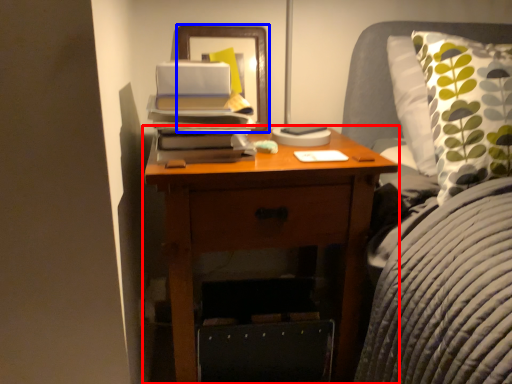
Question: Which object is closer to the camera taking this photo, nightstand (highlighted by a red box) or picture frame (highlighted by a blue box)?

Choices:
 (A) nightstand
 (B) picture frame

Answer: (A)